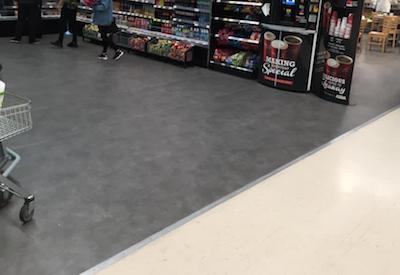
This screenshot has width=400, height=275. Identify the location of cups. (x=341, y=29).